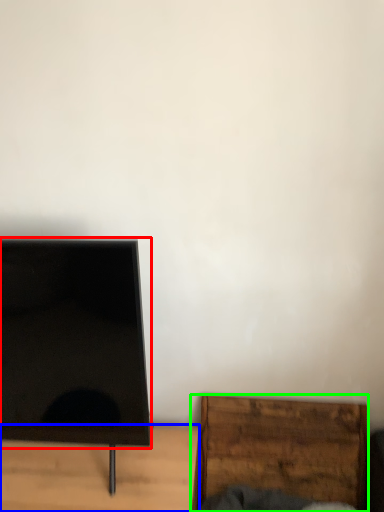
Question: Based on their relative distances, which object is farther from screen (highlighted by a red box)? Choose from furniture (highlighted by a blue box) and furniture (highlighted by a green box).

Choices:
 (A) furniture
 (B) furniture

Answer: (B)